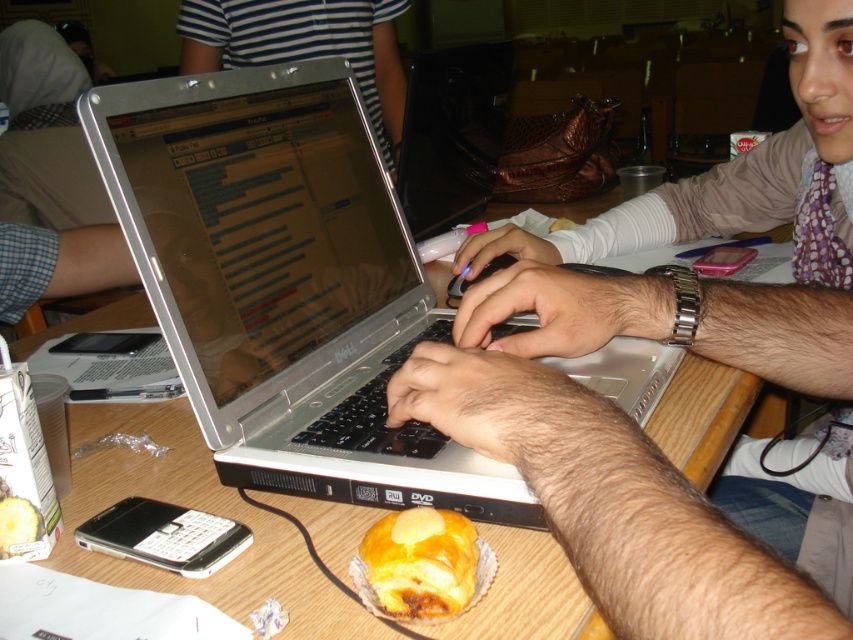
You are a delivery robot navigating to the metallic silver laptop at center. Your current position is at point [693,349]. Can you reach the laptop without moving?

Yes, you are already at the location of the metallic silver laptop at center since your current position is point [693,349] where it is located.

You are a person sitting at the table in the image. You want to reach for the metallic silver laptop at center without touching the striped fabric shirt at upper center. Is this possible?

The metallic silver laptop at center is positioned under striped fabric shirt at upper center, so you can reach for the metallic silver laptop at center without touching the striped fabric shirt at upper center as it is located below it.

You are a delivery robot trying to place a package on the table. The package must be placed at the coordinates point (451, 132). However, there is an object at that location. What object is blocking the delivery robot from placing the package there?

The point (451, 132) corresponds to the glossy plastic laptop at center, so the glossy plastic laptop at center is blocking the delivery robot from placing the package there.